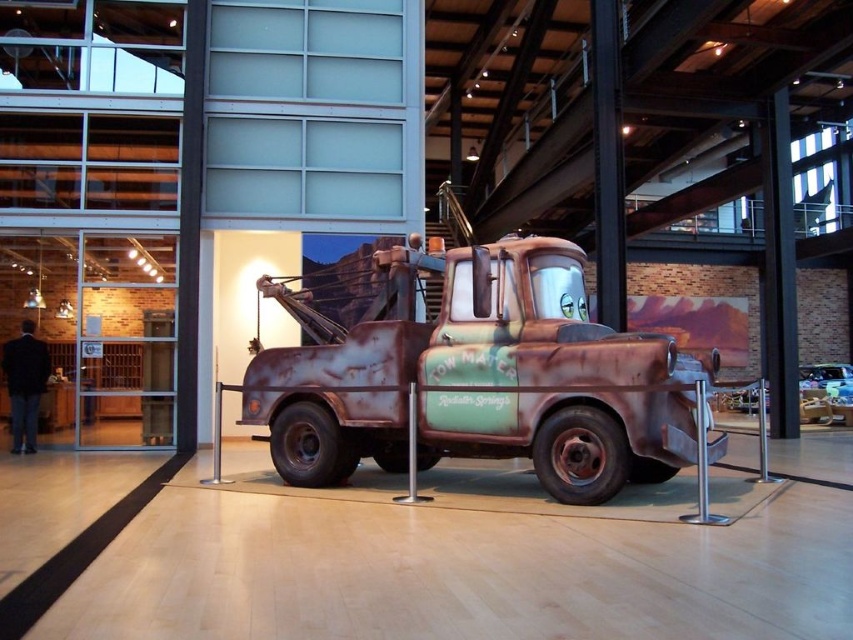
You are a visitor at the exhibition and want to take a photo of both the rusty metal tow truck at center and the shiny silver car at center. Since you can only focus on one object at a time, which one should you position closer to the camera to ensure it is in focus while the other remains slightly blurred?

You should position the rusty metal tow truck at center closer to the camera because it is to the left of the shiny silver car at center, so adjusting the focus accordingly would blur the background object.

From the picture: You are a museum curator planning to move the rusty metal tow truck at center and the shiny silver car at center to a new exhibition hall. The new hall has a narrow corridor that can only accommodate items up to 2 meters in width. Based on the current scene, which of the two vehicles might not fit through the corridor? Explain your reasoning.

The rusty metal tow truck at center has a larger width than the shiny silver car at center. Since the corridor can only accommodate items up to 2 meters wide, the rusty metal tow truck at center might not fit if its width exceeds 2 meters, while the smaller shiny silver car at center would likely fit.

You are a visitor at the exhibition and want to take a photo of the rusty metal tow truck at center. If your camera has a minimum focusing distance of 3 meters, will you be able to take a clear photo without moving closer?

The rusty metal tow truck at center is 5.31 meters away from the viewer. Since the camera can focus as close as 3 meters, you can take a clear photo without moving closer because the distance is within the camera